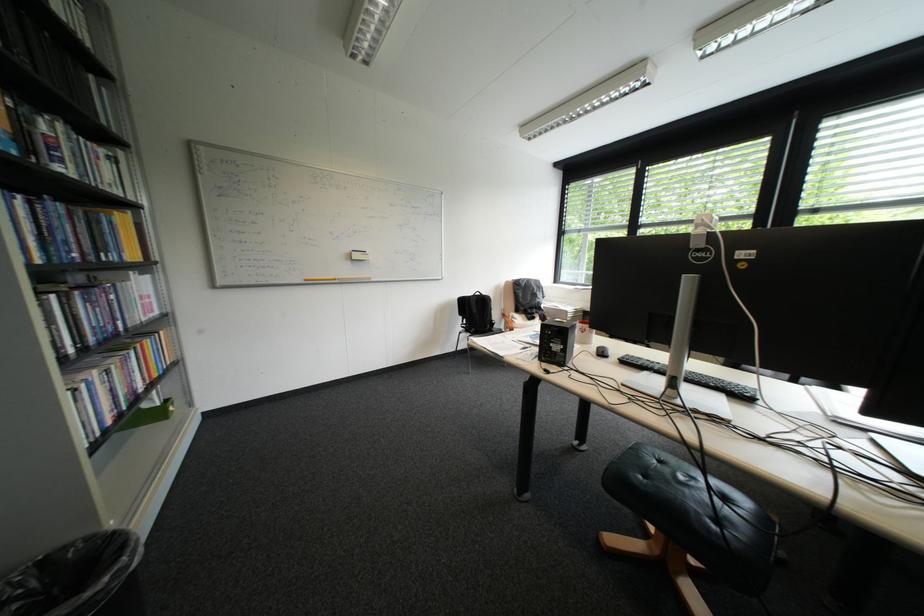
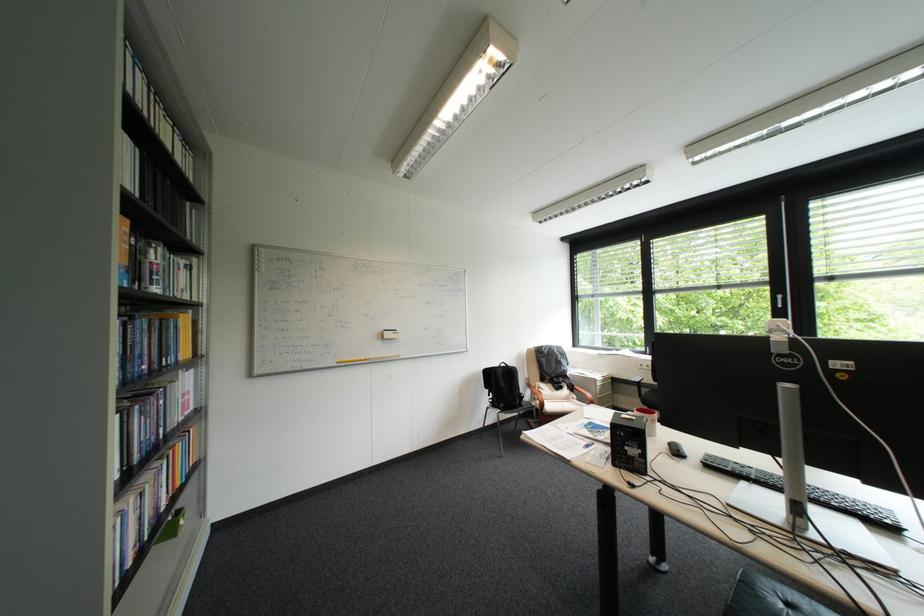
In the second image, find the point that corresponds to pixel 472 315 in the first image.

(497, 387)